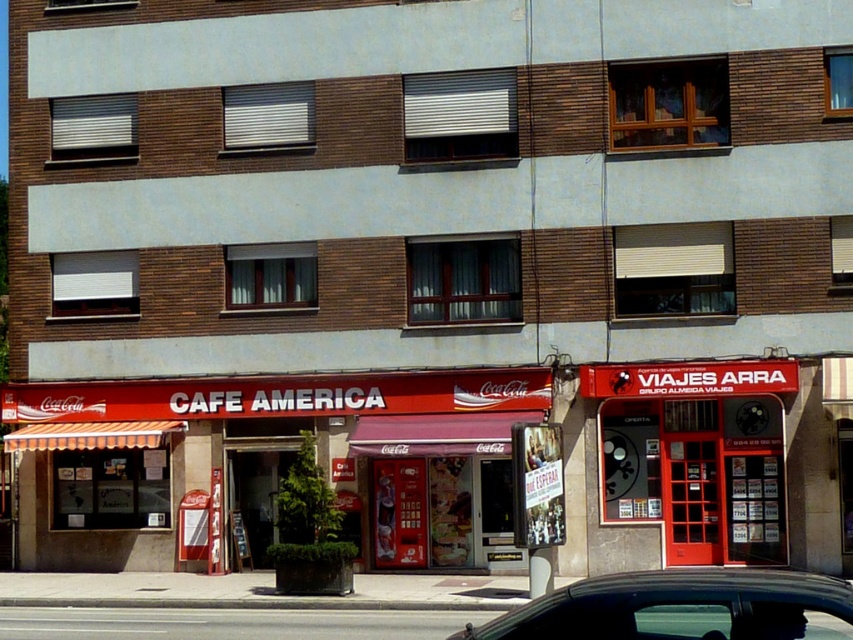
You are standing at the entrance of the CAFE AMERICA and want to place a new menu board between the two points, point 1 at point (766, 515) and point 2 at point (810, 573). Which point should the menu board be closer to if you want it to be more visible to customers entering the cafe?

The menu board should be placed closer to point (766, 515) because it is closer to the viewer, making it more visible to customers entering the cafe.